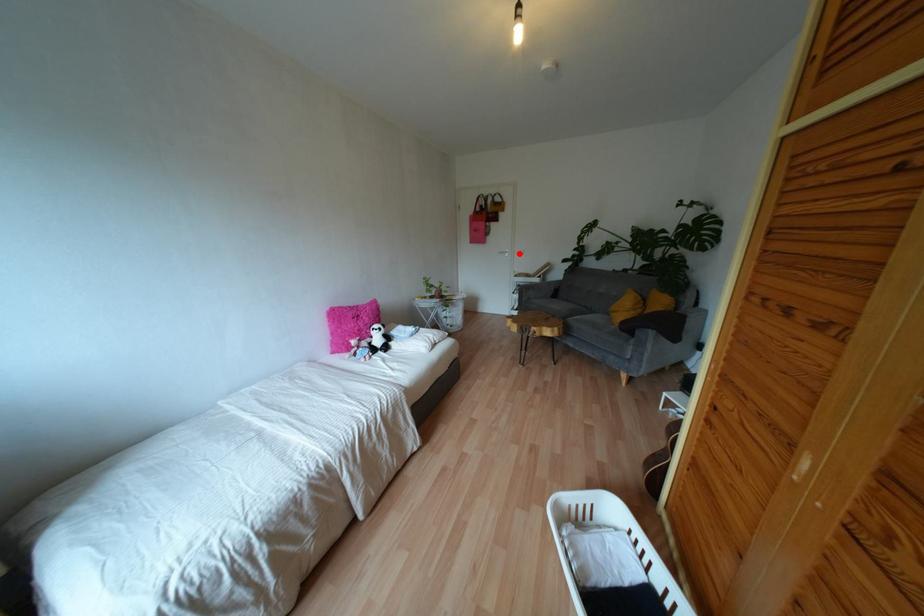
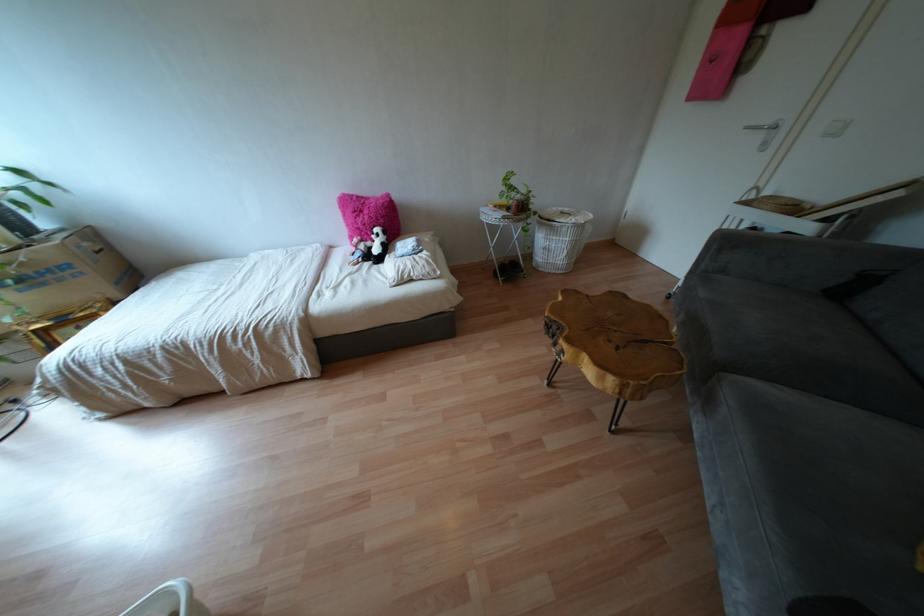
Locate, in the second image, the point that corresponds to the highlighted location in the first image.

(827, 134)